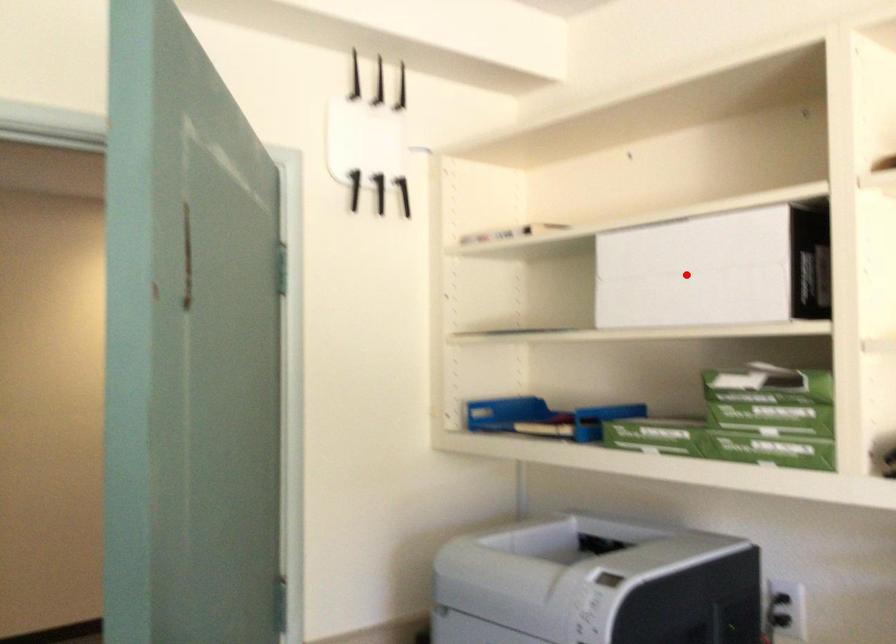
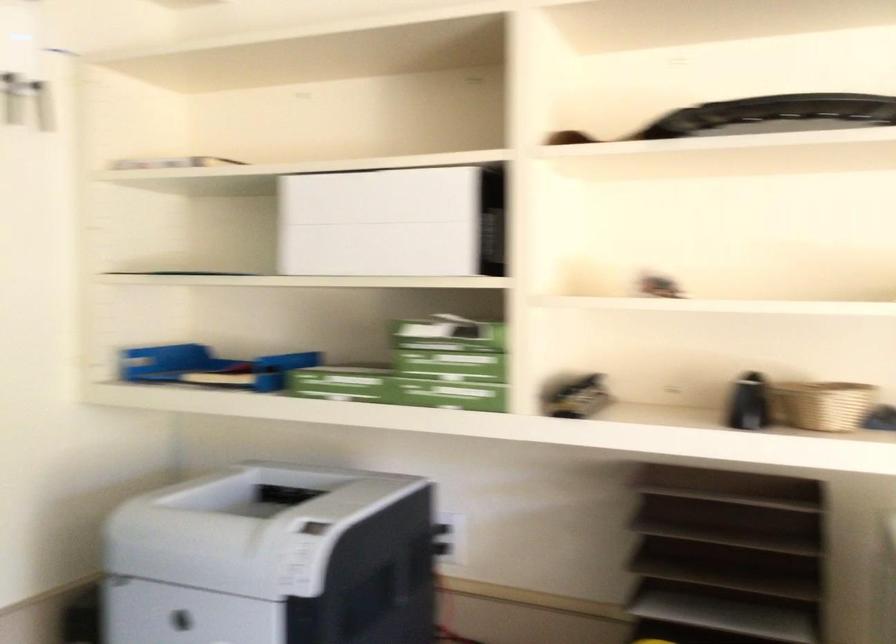
In the second image, find the point that corresponds to the highlighted location in the first image.

(380, 223)